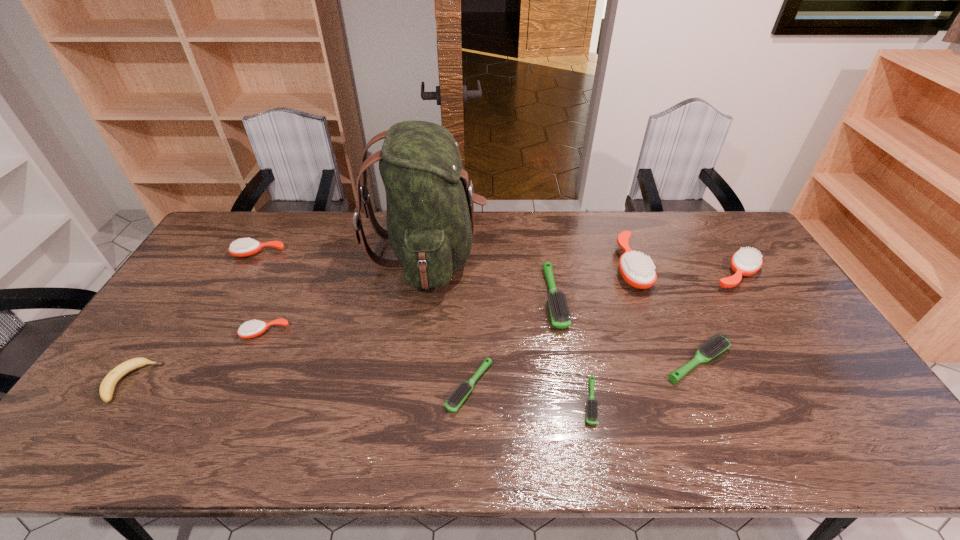
Find the location of a particular element. backpack is located at coordinates (430, 215).

Where is `the tallest object`? the tallest object is located at coordinates (430, 215).

Find the location of a particular element. the third orange hairbrush from left to right is located at coordinates (638, 270).

Where is `the second tallest object`? The image size is (960, 540). the second tallest object is located at coordinates (638, 270).

Where is `the second biggest orange hairbrush`? The image size is (960, 540). the second biggest orange hairbrush is located at coordinates [x=745, y=262].

At what (x,y) coordinates should I click in order to perform the action: click on the rightmost orange hairbrush. Please return your answer as a coordinate pair (x, y). This screenshot has width=960, height=540. Looking at the image, I should click on (745, 262).

Where is `the third biggest orange hairbrush`? the third biggest orange hairbrush is located at coordinates (244, 247).

This screenshot has width=960, height=540. Identify the location of the biggest light hairbrush. 558,304.

Where is `the rightmost light hairbrush`? Image resolution: width=960 pixels, height=540 pixels. the rightmost light hairbrush is located at coordinates (718, 343).

Find the location of `the nearest orange hairbrush`. the nearest orange hairbrush is located at coordinates point(250,329).